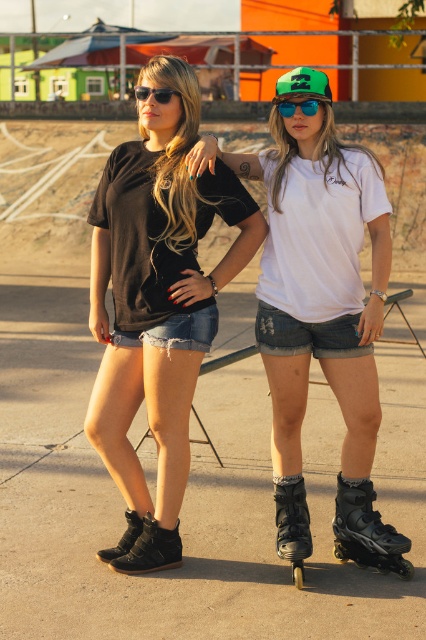
Does black suede booties at center have a lesser height compared to blue reflective lens goggles at center?

No, black suede booties at center is not shorter than blue reflective lens goggles at center.

Which is in front, point (176, 164) or point (282, 115)?

Point (282, 115) is more forward.

The height and width of the screenshot is (640, 426). Find the location of `black suede booties at center`. black suede booties at center is located at coordinates (157, 305).

Who is taller, white matte t-shirt at center or black rubber roller skate at lower center?

With more height is white matte t-shirt at center.

The height and width of the screenshot is (640, 426). Describe the element at coordinates (319, 291) in the screenshot. I see `white matte t-shirt at center` at that location.

Is point (322, 195) farther from camera compared to point (305, 516)?

No.

Where is `white matte t-shirt at center`? white matte t-shirt at center is located at coordinates (319, 291).

Which is behind, point (302, 198) or point (344, 525)?

The point (344, 525) is behind.

Between white matte t-shirt at center and black matte roller skate at lower right, which one is positioned higher?

white matte t-shirt at center is higher up.

Measure the distance between white matte t-shirt at center and camera.

They are 15.54 feet apart.

You are a GUI agent. You are given a task and a screenshot of the screen. Output one action in this format:
    pyautogui.click(x=<x>, y=<y>)
    Task: Click on the white matte t-shirt at center
    
    Given the screenshot: What is the action you would take?
    pyautogui.click(x=319, y=291)